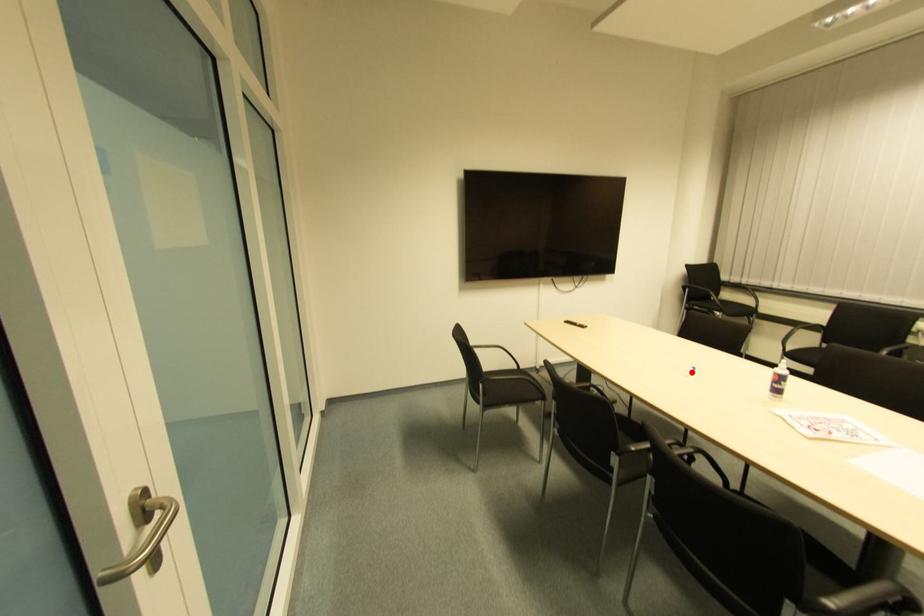
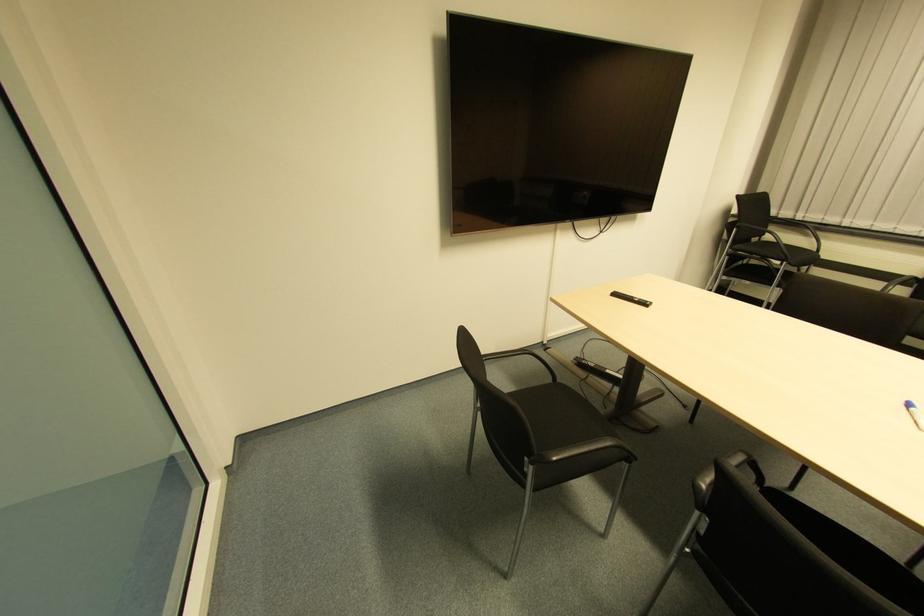
In the second image, find the point that corresponds to the highlighted location in the first image.

(907, 408)